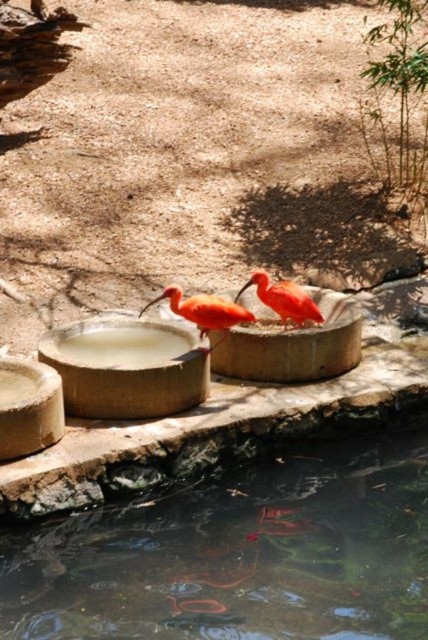
Question: Can you confirm if clear water at pond center is bigger than orange matte ibis at center?

Choices:
 (A) yes
 (B) no

Answer: (A)

Question: Which object appears closest to the camera in this image?

Choices:
 (A) orange matte ibis at center
 (B) clear water at pond center

Answer: (B)

Question: Does orange matte ibis at center have a larger size compared to bright orange bird at center?

Choices:
 (A) yes
 (B) no

Answer: (A)

Question: Can you confirm if clear water at pond center is wider than bright orange bird at center?

Choices:
 (A) yes
 (B) no

Answer: (A)

Question: Which object is the closest to the smooth concrete basin at lower left?

Choices:
 (A) orange matte ibis at center
 (B) bright orange bird at center
 (C) clear water at pond center

Answer: (A)

Question: Which object is closer to the camera taking this photo?

Choices:
 (A) bright orange bird at center
 (B) clear water at pond center
 (C) orange matte ibis at center

Answer: (B)